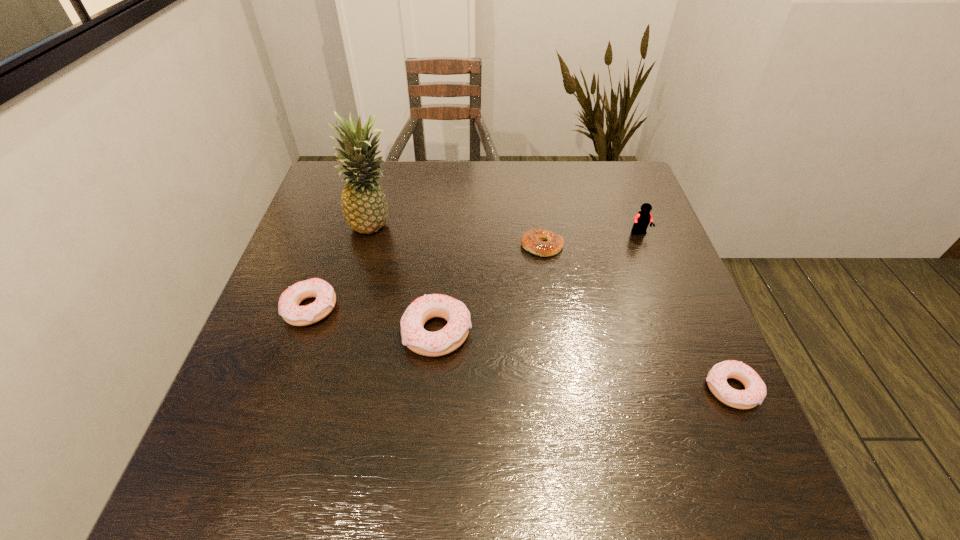
If we want them evenly spaced by inserting an extra doughnut among them, please locate a free spot for this new doughnut. Please provide its 2D coordinates. Your answer should be formatted as a tuple, i.e. [(x, y)], where the tuple contains the x and y coordinates of a point satisfying the conditions above.

[(576, 359)]